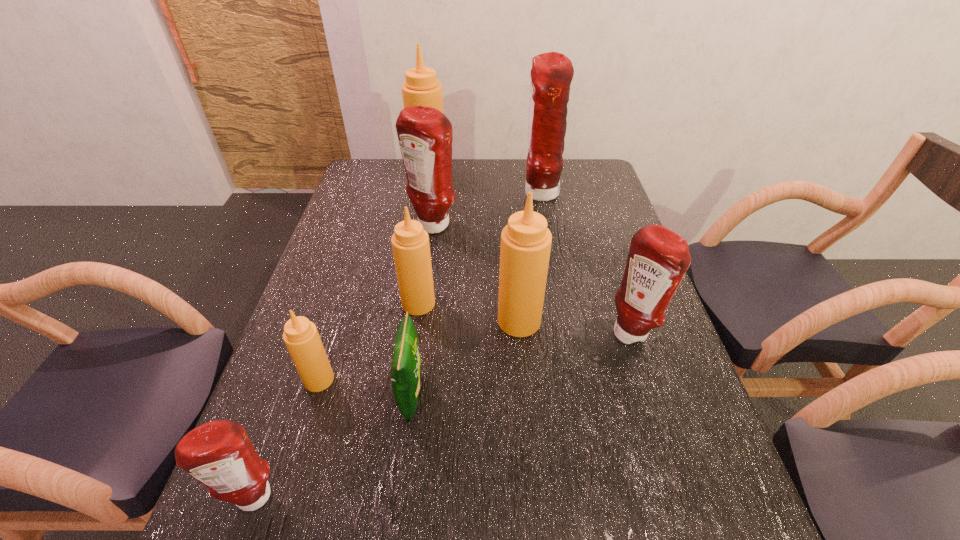
Locate an element on the screen. The height and width of the screenshot is (540, 960). the leftmost red condiment is located at coordinates (219, 454).

I want to click on the smallest tan condiment, so click(x=301, y=337).

Locate an element on the screen. This screenshot has width=960, height=540. the nearest tan condiment is located at coordinates (301, 337).

I want to click on crisp (potato chip), so click(x=406, y=362).

Find the location of a particular element. Image resolution: width=960 pixels, height=540 pixels. green crisp (potato chip) is located at coordinates (406, 362).

Image resolution: width=960 pixels, height=540 pixels. Identify the location of free space located on the right of the farthest tan condiment. (491, 176).

Where is `blank space located on the right of the third red condiment from left to right`? blank space located on the right of the third red condiment from left to right is located at coordinates (576, 194).

Where is `free space located 0.250m on the front of the second biggest tan condiment`? free space located 0.250m on the front of the second biggest tan condiment is located at coordinates (529, 435).

I want to click on vacant space situated on the front of the third smallest red condiment, so click(420, 318).

Where is `free region located on the left of the third biggest tan condiment`? This screenshot has width=960, height=540. free region located on the left of the third biggest tan condiment is located at coordinates (318, 303).